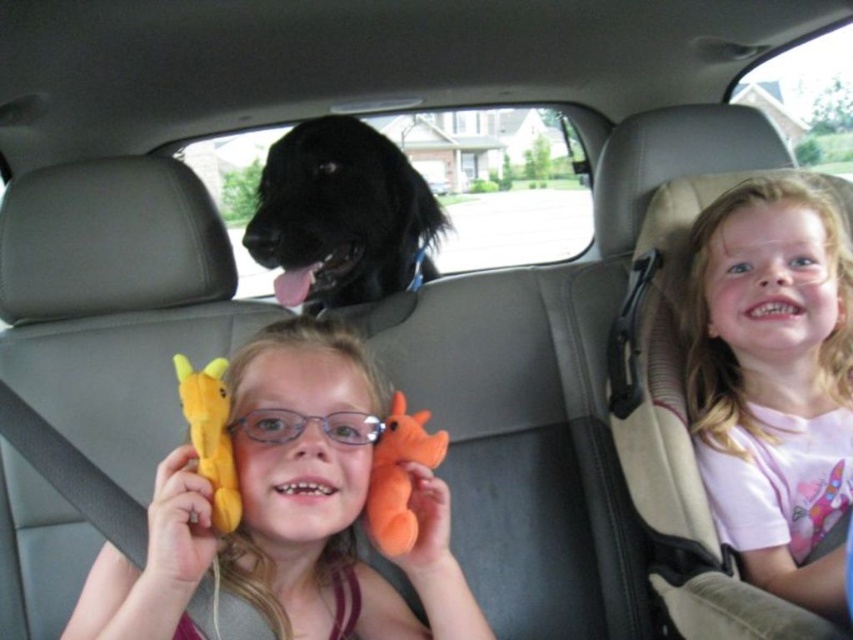
You are a parent trying to fit both the soft plush toy at center and the orange plush toy at center into a rectangular storage box. The box is exactly as wide as the wider of the two toys. Which toy determines the minimum required width of the box?

The soft plush toy at center might be wider than orange plush toy at center, so the minimum width of the box should be determined by the soft plush toy at center to ensure both fit.

From the picture: You are a passenger in the car and want to reach a snack bag located at point (204, 490). There is an object at point (289, 244) blocking your path. Can you safely reach the snack bag without moving the object?

Point (204, 490) is in front of point (289, 244), so you can safely reach the snack bag at point (204, 490) without moving the object at point (289, 244) because it is behind the snack bag.